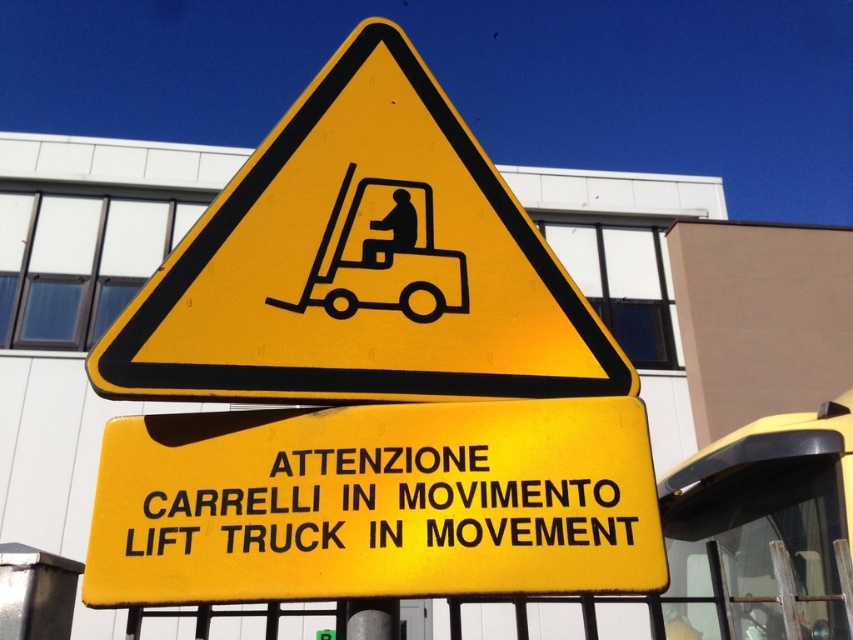
Question: Does yellow matte sign at center appear on the left side of black matte forklift at center?

Choices:
 (A) yes
 (B) no

Answer: (B)

Question: Which point appears farthest from the camera in this image?

Choices:
 (A) (453, 282)
 (B) (518, 291)

Answer: (B)

Question: Is yellow matte triangle at upper center bigger than yellow matte sign at center?

Choices:
 (A) no
 (B) yes

Answer: (B)

Question: Which of the following is the farthest from the observer?

Choices:
 (A) (467, 301)
 (B) (469, 403)
 (C) (231, 262)

Answer: (A)

Question: Does yellow matte sign at center appear on the left side of black matte forklift at center?

Choices:
 (A) no
 (B) yes

Answer: (A)

Question: Estimate the real-world distances between objects in this image. Which object is closer to the black matte forklift at center?

Choices:
 (A) yellow matte sign at center
 (B) yellow matte triangle at upper center

Answer: (B)